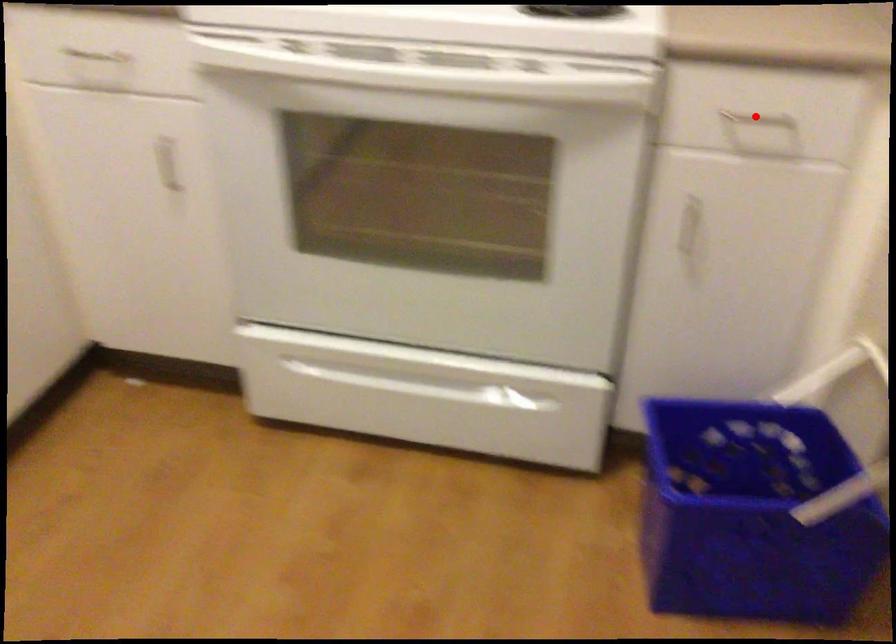
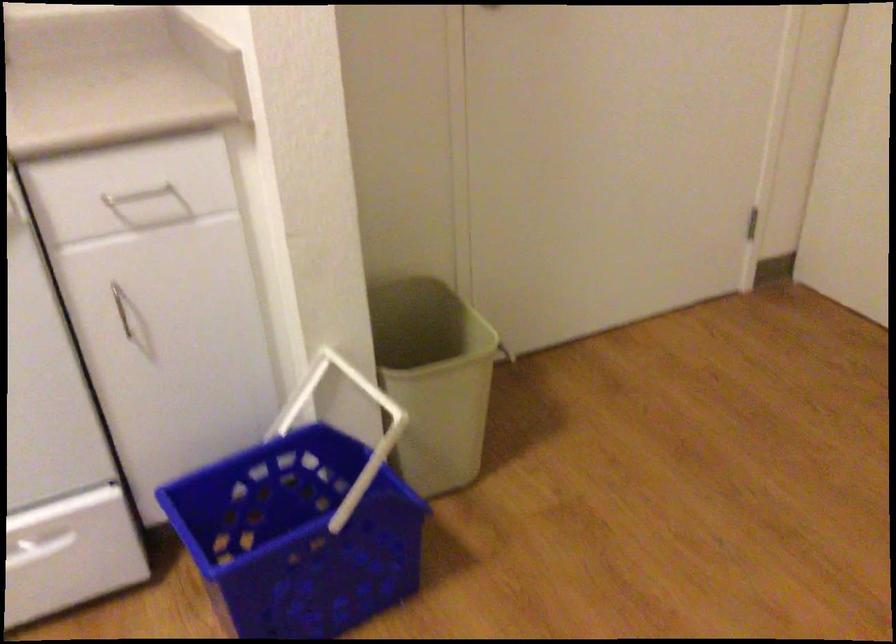
Find the pixel in the second image that matches the highlighted location in the first image.

(138, 194)